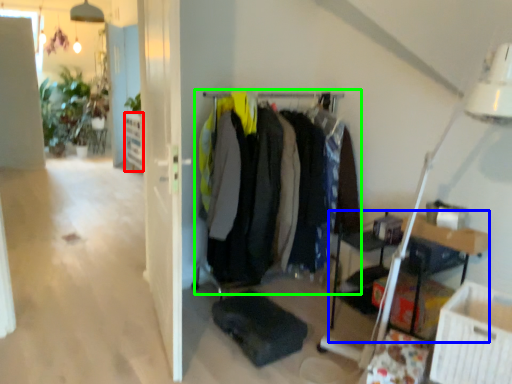
Question: Considering the real-world distances, which object is farthest from shelf (highlighted by a red box)? table (highlighted by a blue box) or closet (highlighted by a green box)?

Choices:
 (A) table
 (B) closet

Answer: (A)